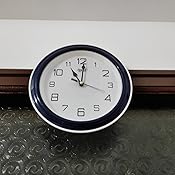
What are the coordinates of `white face of clock` in the screenshot? It's located at (74, 94).